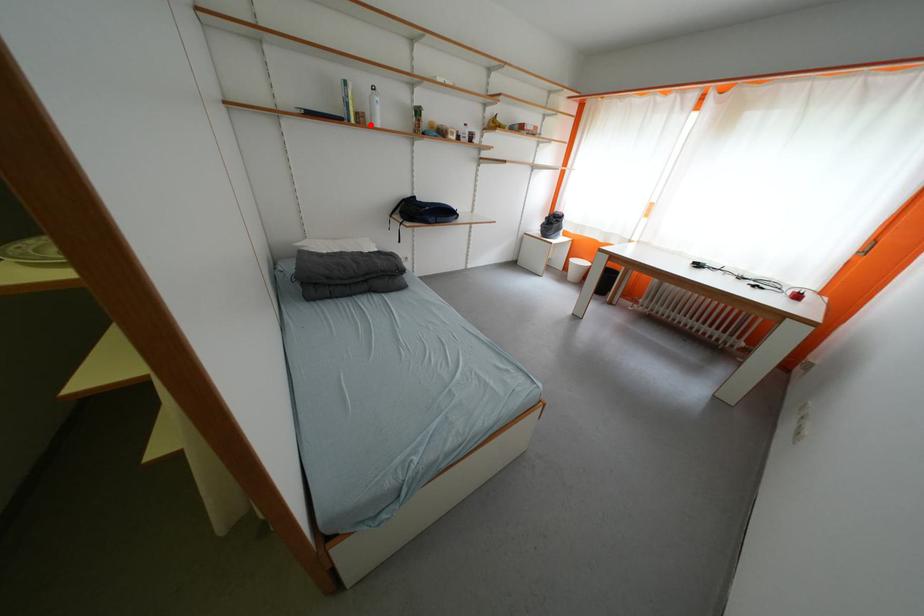
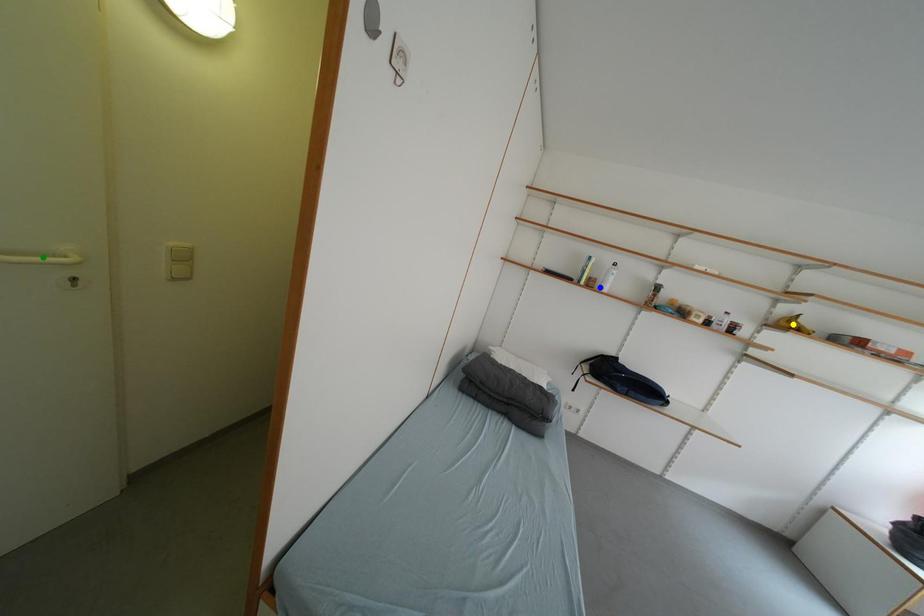
Question: I am providing you with two images of the same scene from different viewpoints. A red point is marked on the first image. You are given multiple points on the second image. Which point in image 2 represents the same 3d spot as the red point in image 1?

Choices:
 (A) blue point
 (B) green point
 (C) yellow point

Answer: (A)